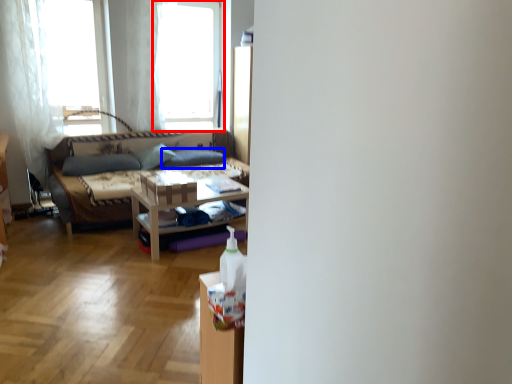
Question: Which point is further to the camera, window (highlighted by a red box) or pillow (highlighted by a blue box)?

Choices:
 (A) window
 (B) pillow

Answer: (B)